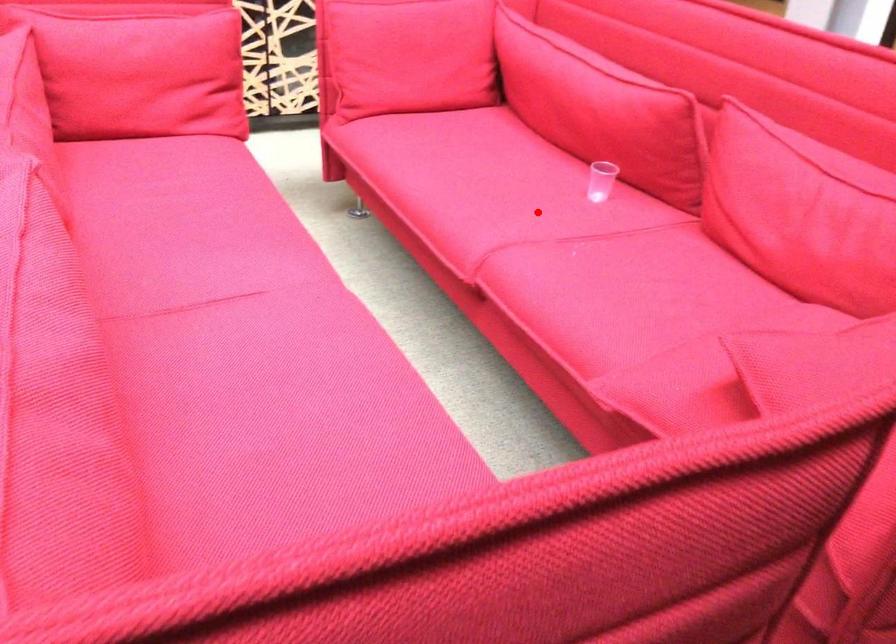
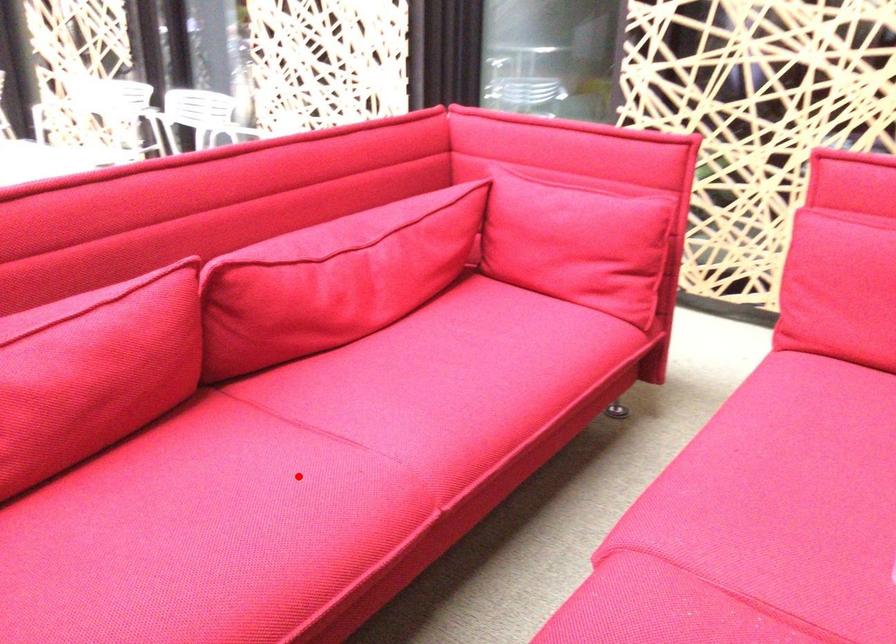
I am providing you with two images of the same scene from different viewpoints. A red point is marked on the first image and another point is marked on the second image. Does the point marked in image1 correspond to the same location as the one in image2?

No